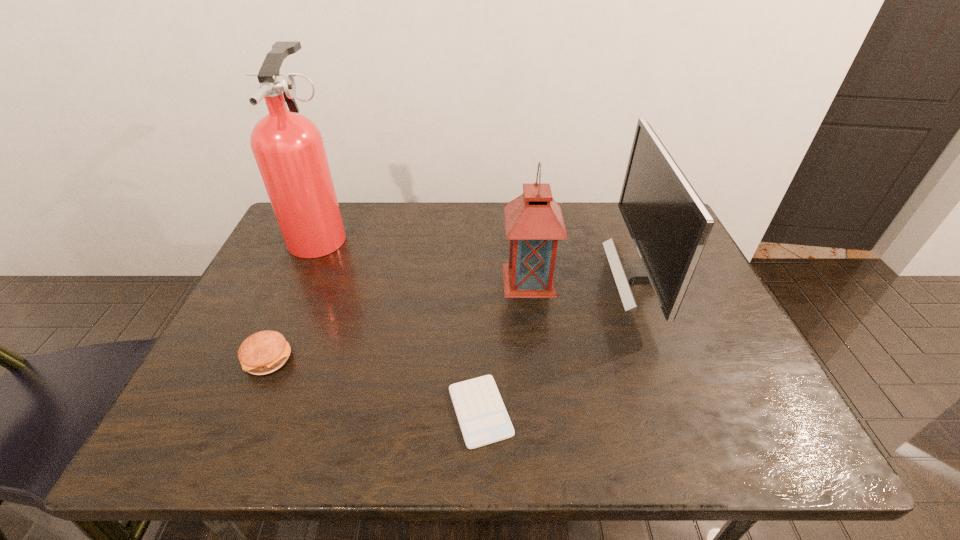
The image size is (960, 540). I want to click on the tallest object, so click(x=288, y=147).

Find the location of a particular element. The height and width of the screenshot is (540, 960). lantern is located at coordinates (534, 223).

Image resolution: width=960 pixels, height=540 pixels. Find the location of `monitor`. monitor is located at coordinates (669, 224).

The image size is (960, 540). I want to click on hamburger, so click(264, 352).

At what (x,y) coordinates should I click in order to perform the action: click on calculator. Please return your answer as a coordinate pair (x, y). Looking at the image, I should click on (483, 419).

Where is `vacant space positioned 0.210m on the front of the tallest object`? The height and width of the screenshot is (540, 960). vacant space positioned 0.210m on the front of the tallest object is located at coordinates (283, 318).

In order to click on vacant space situated on the front of the lantern in this screenshot , I will do `click(533, 315)`.

Where is `free region located 0.400m on the screen side of the rightmost object`? free region located 0.400m on the screen side of the rightmost object is located at coordinates (468, 275).

Find the location of a particular element. The width and height of the screenshot is (960, 540). vacant space positioned on the screen side of the rightmost object is located at coordinates (565, 275).

This screenshot has width=960, height=540. Identify the location of vacant point located on the screen side of the rightmost object. (533, 275).